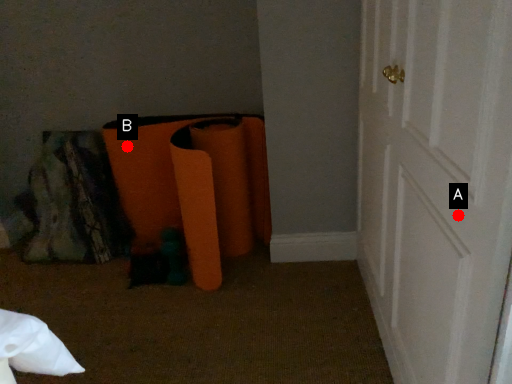
Question: Two points are circled on the image, labeled by A and B beside each circle. Which point is further to the camera?

Choices:
 (A) A is further
 (B) B is further

Answer: (B)